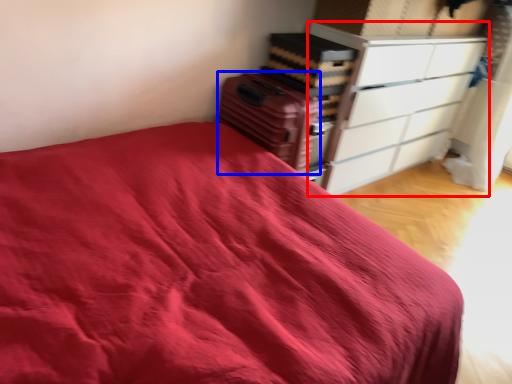
Question: Which of the following is the farthest to the observer, chest of drawers (highlighted by a red box) or luggage (highlighted by a blue box)?

Choices:
 (A) chest of drawers
 (B) luggage

Answer: (A)